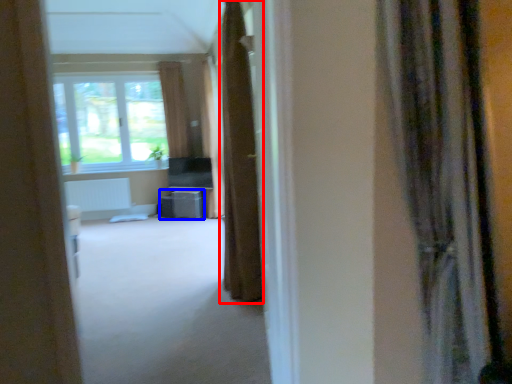
Question: Among these objects, which one is nearest to the camera, curtain (highlighted by a red box) or furniture (highlighted by a blue box)?

Choices:
 (A) curtain
 (B) furniture

Answer: (A)